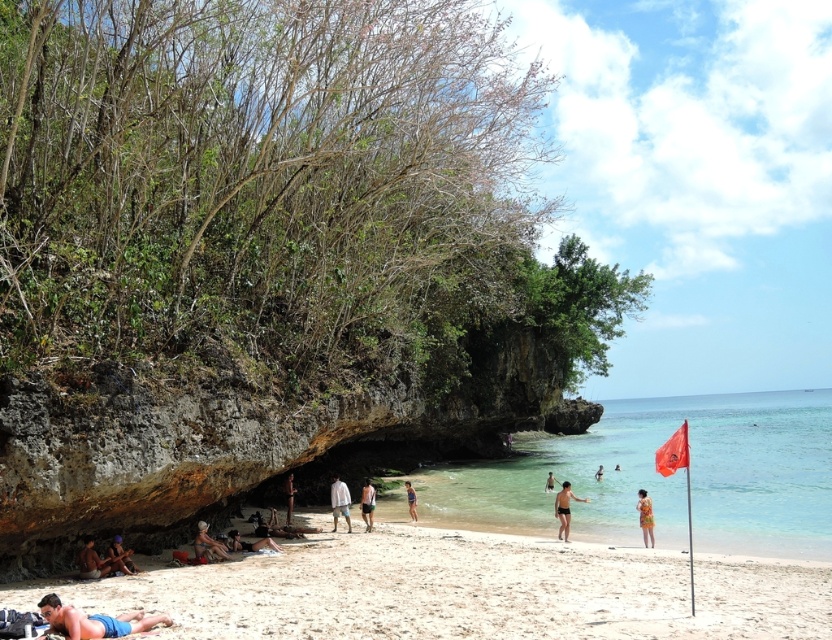
You are standing at the beach and see two points marked on the sand. The first point is at coordinates point (82, 561) and the second point is at point (369, 509). Which point is closer to you?

Point (82, 561) is in front of point (369, 509), so it is closer to you.

You are a photographer trying to capture the entire scene of the beach. You notice the matte brown skin at lower left and the green fabric shorts at center. Which object would require you to zoom out more to include both in the frame?

The matte brown skin at lower left has a lesser width compared to green fabric shorts at center, so you would need to zoom out more to include both the matte brown skin at lower left and the green fabric shorts at center in the frame.